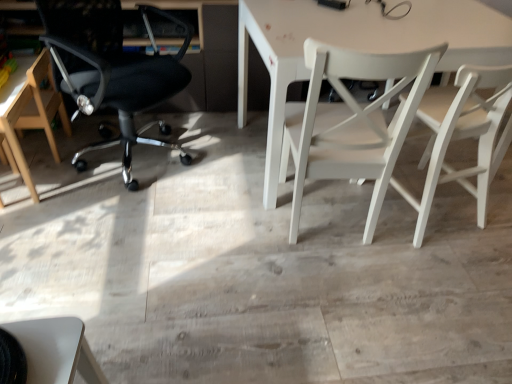
What are the coordinates of `vacant space that's between white matte table at center and black mesh office chair at left, which is counted as the 3th chair, starting from the right` in the screenshot? It's located at (213, 165).